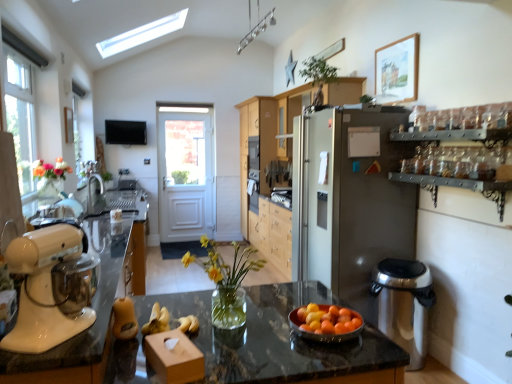
Locate an element on the screen. blank area to the left of orange matte bowl at center is located at coordinates (263, 332).